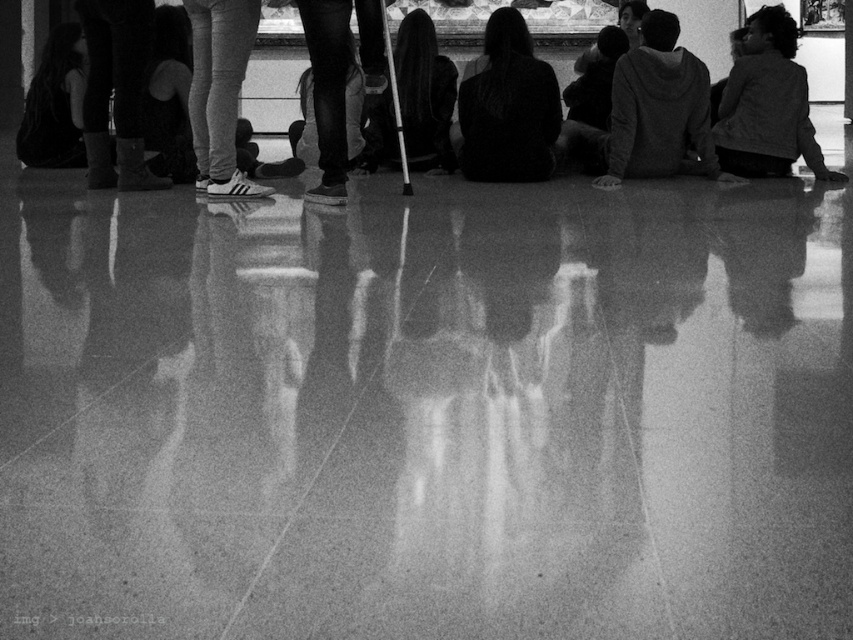
Measure the distance from dark hair at center to dark gray hoodie at upper right.

A distance of 3.35 meters exists between dark hair at center and dark gray hoodie at upper right.

Who is shorter, dark hair at center or dark gray hoodie at upper right?

Standing shorter between the two is dark hair at center.

Which is behind, point (486, 99) or point (772, 140)?

Point (486, 99)

You are a GUI agent. You are given a task and a screenshot of the screen. Output one action in this format:
    pyautogui.click(x=<x>, y=<y>)
    Task: Click on the dark hair at center
    The image size is (853, 640).
    Given the screenshot: What is the action you would take?
    pyautogui.click(x=508, y=106)

Which is more to the left, gray hoodie at center or dark gray hoodie at upper right?

gray hoodie at center is more to the left.

Who is higher up, gray hoodie at center or dark gray hoodie at upper right?

dark gray hoodie at upper right is higher up.

Is point (637, 65) positioned behind point (766, 134)?

No.

The width and height of the screenshot is (853, 640). What are the coordinates of `gray hoodie at center` in the screenshot? It's located at (659, 108).

Is point (679, 147) farther from camera compared to point (526, 131)?

That is True.

Is the position of gray hoodie at center more distant than that of dark hair at center?

That is False.

Describe the element at coordinates (659, 108) in the screenshot. I see `gray hoodie at center` at that location.

Locate an element on the screen. The height and width of the screenshot is (640, 853). gray hoodie at center is located at coordinates (659, 108).